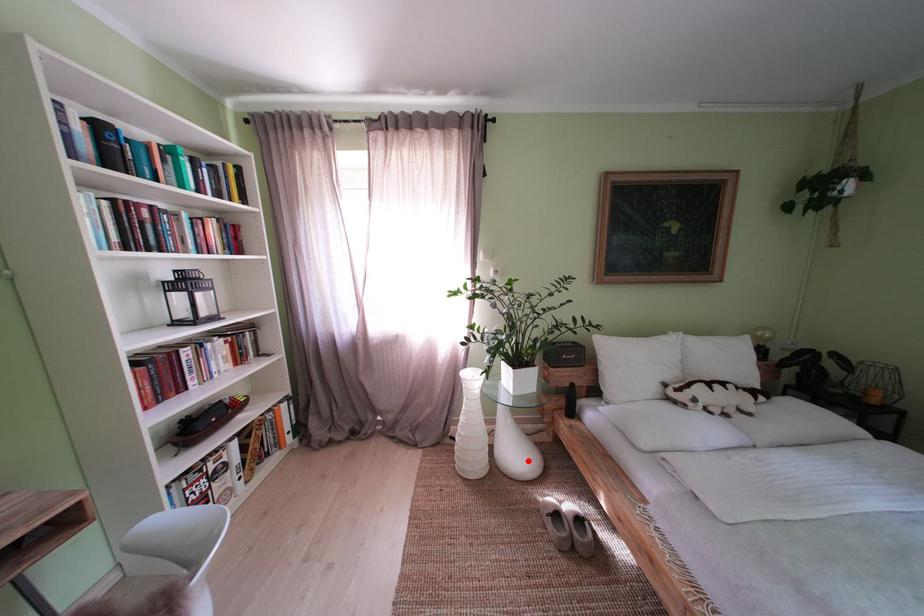
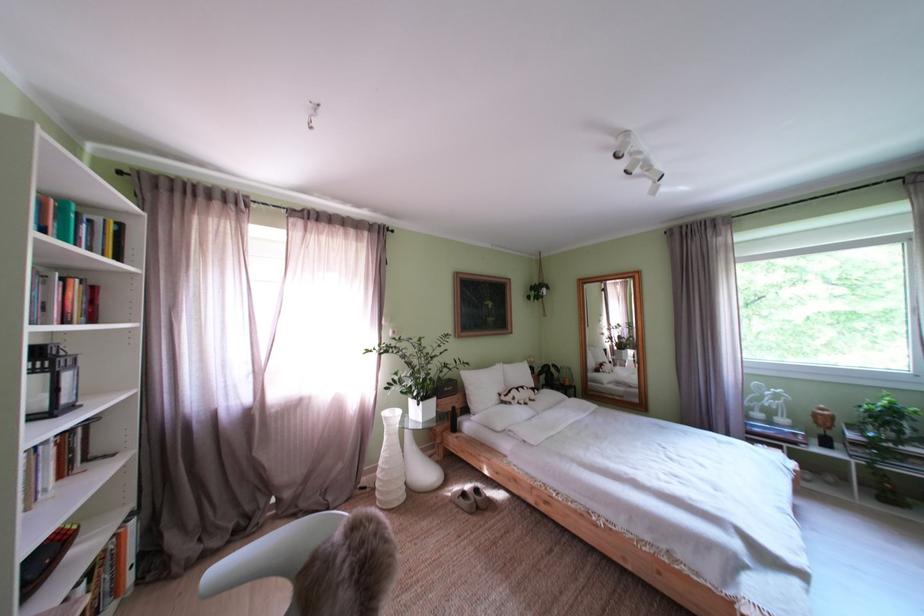
Question: I am providing you with two images of the same scene from different viewpoints. A red point is marked on the first image. Can you still see the location of the red point in image 2?

Choices:
 (A) Yes
 (B) No

Answer: (A)